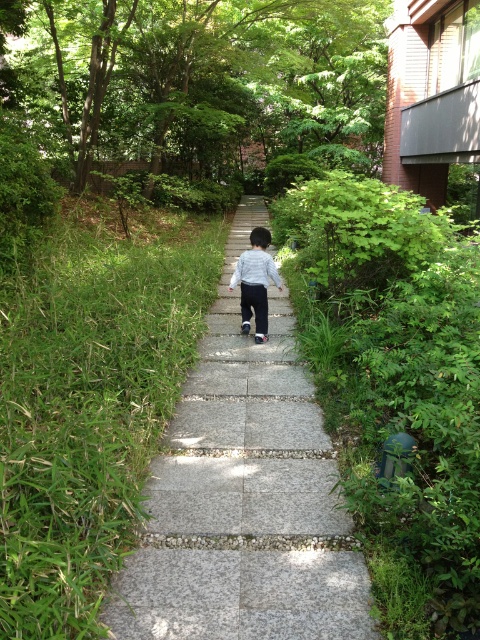
Question: Can you confirm if gray concrete pavement at center is bigger than light gray cotton shirt at center?

Choices:
 (A) no
 (B) yes

Answer: (B)

Question: Does gray concrete pavement at center have a lesser width compared to light gray cotton shirt at center?

Choices:
 (A) yes
 (B) no

Answer: (B)

Question: Is gray concrete pavement at center bigger than light gray cotton shirt at center?

Choices:
 (A) yes
 (B) no

Answer: (A)